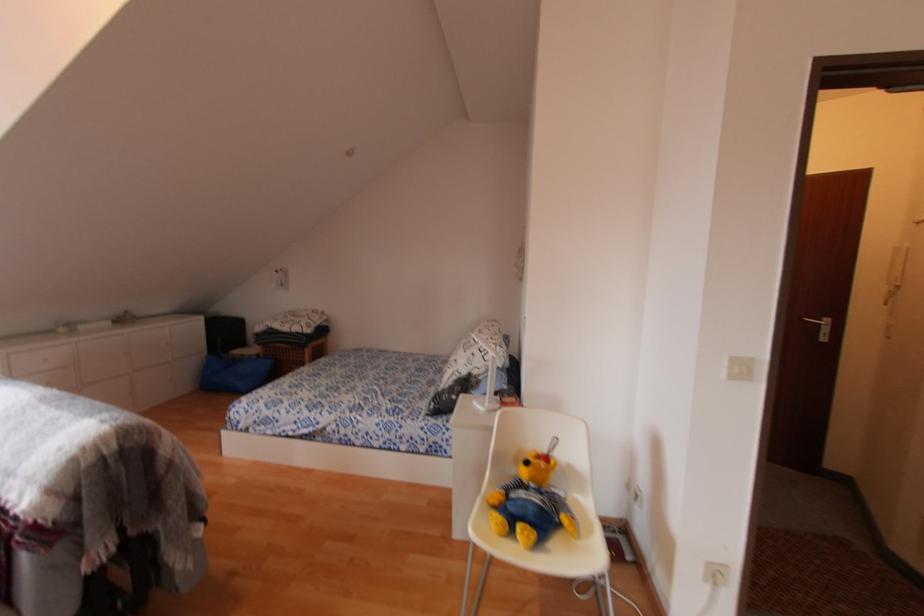
Where would you lift the white patterned pillow? Please return your answer as a coordinate pair (x, y).

(481, 351)